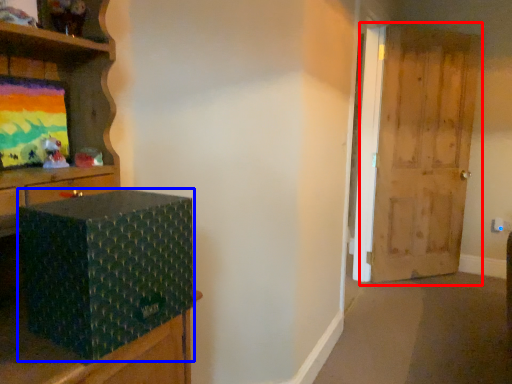
Question: Which object is closer to the camera taking this photo, door (highlighted by a red box) or box (highlighted by a blue box)?

Choices:
 (A) door
 (B) box

Answer: (B)